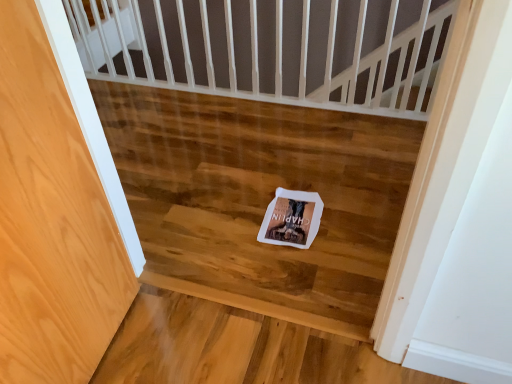
At what (x,y) coordinates should I click in order to perform the action: click on free space to the back side of white paper postcard at center. Please return your answer as a coordinate pair (x, y). Looking at the image, I should click on click(285, 174).